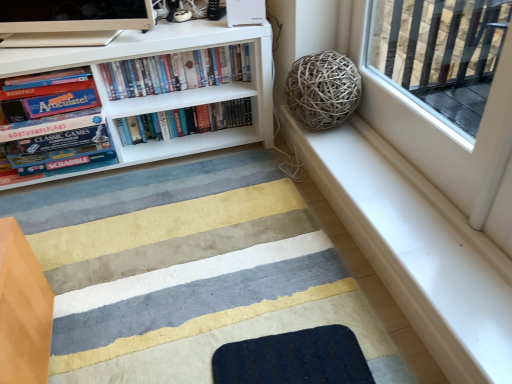
Question: Is the depth of textured wool doormat at lower center, which is the second doormat in back-to-front order, greater than that of dark blue textured mat at lower center, which ranks as the first doormat in back-to-front order?

Choices:
 (A) yes
 (B) no

Answer: (B)

Question: Considering the relative positions of textured wool doormat at lower center, placed as the first doormat when sorted from front to back, and dark blue textured mat at lower center, which ranks as the first doormat in back-to-front order, in the image provided, is textured wool doormat at lower center, placed as the first doormat when sorted from front to back, to the right of dark blue textured mat at lower center, which ranks as the first doormat in back-to-front order, from the viewer's perspective?

Choices:
 (A) yes
 (B) no

Answer: (B)

Question: Can you confirm if textured wool doormat at lower center, which is the second doormat in back-to-front order, is taller than dark blue textured mat at lower center, which is the second doormat in front-to-back order?

Choices:
 (A) no
 (B) yes

Answer: (B)

Question: Is textured wool doormat at lower center, which is the second doormat in back-to-front order, closer to camera compared to dark blue textured mat at lower center, which is the second doormat in front-to-back order?

Choices:
 (A) no
 (B) yes

Answer: (B)

Question: From the image's perspective, is textured wool doormat at lower center, placed as the first doormat when sorted from front to back, over dark blue textured mat at lower center, which is the second doormat in front-to-back order?

Choices:
 (A) yes
 (B) no

Answer: (A)

Question: Does textured wool doormat at lower center, which is the second doormat in back-to-front order, have a lesser height compared to dark blue textured mat at lower center, which ranks as the first doormat in back-to-front order?

Choices:
 (A) yes
 (B) no

Answer: (B)

Question: From a real-world perspective, does textured wool doormat at lower center, placed as the first doormat when sorted from front to back, sit lower than white matte bookcase at upper left?

Choices:
 (A) no
 (B) yes

Answer: (B)

Question: Is textured wool doormat at lower center, placed as the first doormat when sorted from front to back, far away from white matte bookcase at upper left?

Choices:
 (A) yes
 (B) no

Answer: (B)

Question: Is textured wool doormat at lower center, placed as the first doormat when sorted from front to back, thinner than white matte bookcase at upper left?

Choices:
 (A) yes
 (B) no

Answer: (B)

Question: From the image's perspective, is textured wool doormat at lower center, which is the second doormat in back-to-front order, beneath white matte bookcase at upper left?

Choices:
 (A) no
 (B) yes

Answer: (B)

Question: Considering the relative sizes of textured wool doormat at lower center, which is the second doormat in back-to-front order, and white matte bookcase at upper left in the image provided, is textured wool doormat at lower center, which is the second doormat in back-to-front order, bigger than white matte bookcase at upper left?

Choices:
 (A) yes
 (B) no

Answer: (B)

Question: Is textured wool doormat at lower center, placed as the first doormat when sorted from front to back, looking in the opposite direction of white matte bookcase at upper left?

Choices:
 (A) yes
 (B) no

Answer: (B)

Question: Can you confirm if matte board game at left, the third book in the right-to-left sequence, is wider than hardcover books at center, the second book in the right-to-left sequence?

Choices:
 (A) yes
 (B) no

Answer: (A)